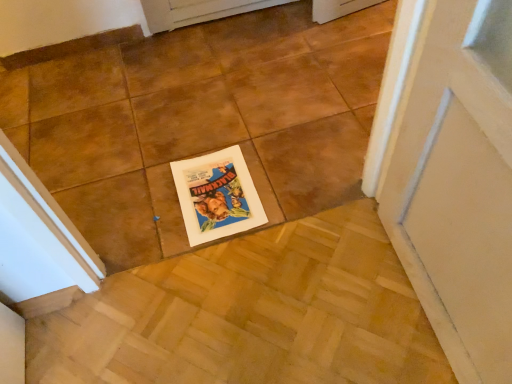
I want to click on white paper comic book at center, so click(217, 195).

What do you see at coordinates (217, 195) in the screenshot?
I see `white paper comic book at center` at bounding box center [217, 195].

Image resolution: width=512 pixels, height=384 pixels. In order to click on white paper comic book at center in this screenshot , I will do `click(217, 195)`.